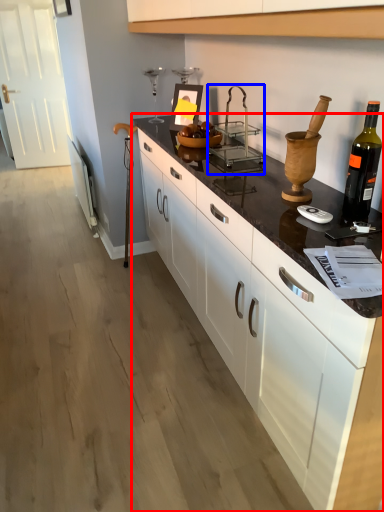
Question: Among these objects, which one is nearest to the camera, countertop (highlighted by a red box) or appliance (highlighted by a blue box)?

Choices:
 (A) countertop
 (B) appliance

Answer: (A)